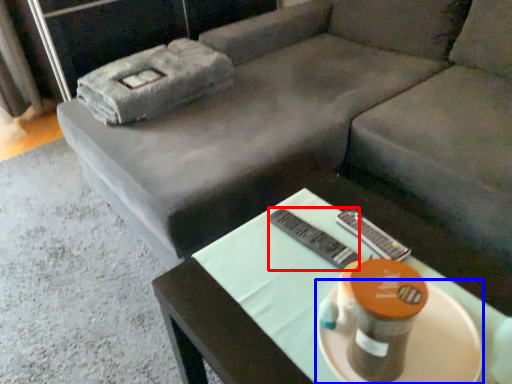
Question: Which of the following is the farthest to the observer, remote (highlighted by a red box) or platter (highlighted by a blue box)?

Choices:
 (A) remote
 (B) platter

Answer: (A)